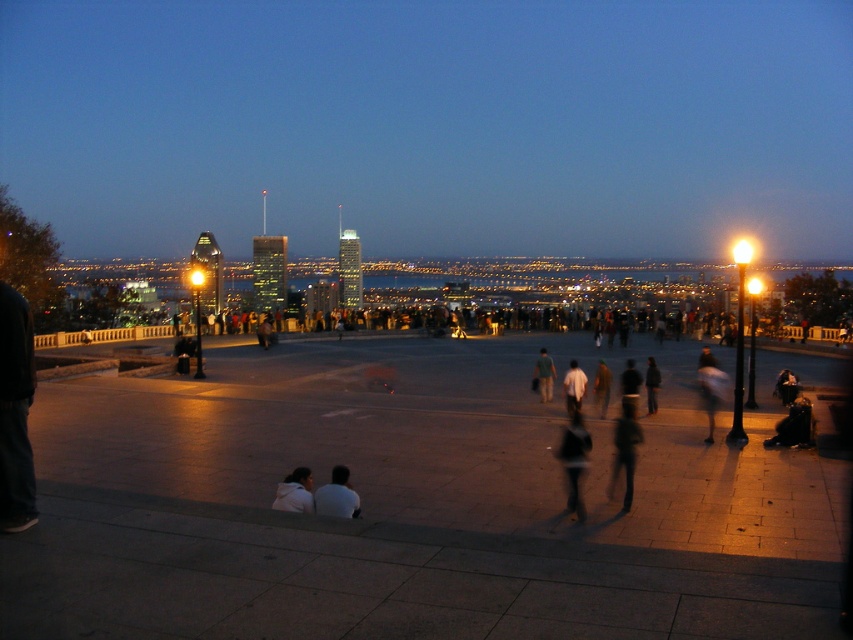
Does light brown leather jacket at lower center have a greater height compared to light blue jeans at center?

Incorrect, light brown leather jacket at lower center's height is not larger of light blue jeans at center's.

Which is below, light brown leather jacket at lower center or light blue jeans at center?

light blue jeans at center

Between point (280, 483) and point (541, 358), which one is positioned behind?

Positioned behind is point (541, 358).

I want to click on light brown leather jacket at lower center, so click(x=294, y=492).

Does dark gray fabric jacket at center appear over dark gray jacket at center?

Indeed, dark gray fabric jacket at center is positioned over dark gray jacket at center.

This screenshot has height=640, width=853. Find the location of `dark gray fabric jacket at center`. dark gray fabric jacket at center is located at coordinates (573, 461).

Image resolution: width=853 pixels, height=640 pixels. What are the coordinates of `dark gray fabric jacket at center` in the screenshot? It's located at pos(573,461).

Between point (579, 506) and point (566, 371), which one is positioned behind?

The point (566, 371) is more distant.

Image resolution: width=853 pixels, height=640 pixels. Find the location of `dark gray fabric jacket at center`. dark gray fabric jacket at center is located at coordinates (573, 461).

Where is `dark gray fabric jacket at center`? dark gray fabric jacket at center is located at coordinates (573, 461).